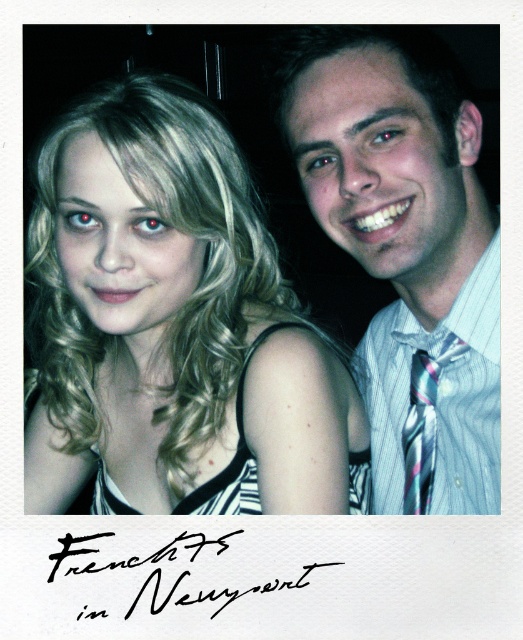
Is point (394, 177) farther from camera compared to point (72, 570)?

That is False.

I want to click on striped shirt at center, so click(407, 252).

At what (x,y) coordinates should I click in order to perform the action: click on striped shirt at center. Please return your answer as a coordinate pair (x, y). Looking at the image, I should click on (407, 252).

Is blonde hair at center to the left of multicolored silk tie at right from the viewer's perspective?

Yes, blonde hair at center is to the left of multicolored silk tie at right.

The width and height of the screenshot is (523, 640). I want to click on blonde hair at center, so click(176, 326).

This screenshot has height=640, width=523. In order to click on blonde hair at center in this screenshot , I will do `click(176, 326)`.

Between point (160, 148) and point (473, 378), which one is positioned behind?

The point (473, 378) is behind.

Is the position of blonde hair at center less distant than that of striped shirt at center?

That is False.

At what (x,y) coordinates should I click in order to perform the action: click on blonde hair at center. Please return your answer as a coordinate pair (x, y). Looking at the image, I should click on (176, 326).